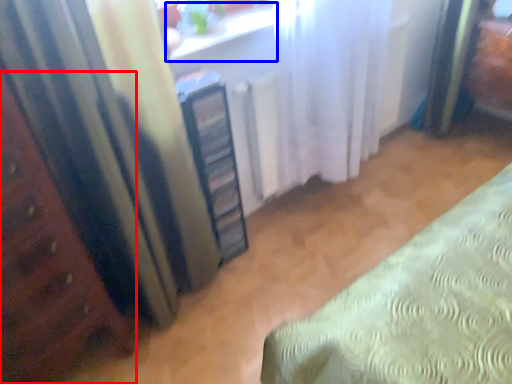
Question: Which of the following is the closest to the observer, furniture (highlighted by a red box) or window sill (highlighted by a blue box)?

Choices:
 (A) furniture
 (B) window sill

Answer: (A)